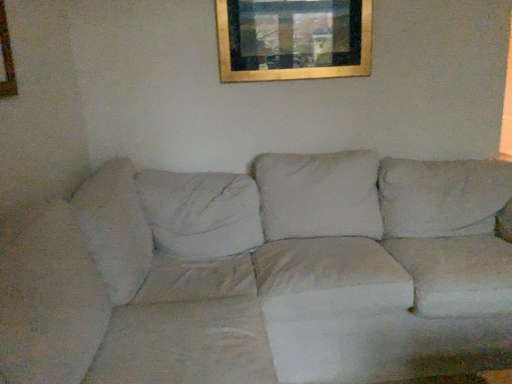
This screenshot has width=512, height=384. Describe the element at coordinates (261, 274) in the screenshot. I see `white fabric couch at center` at that location.

Find the location of `white fabric couch at center`. white fabric couch at center is located at coordinates (x=261, y=274).

This screenshot has width=512, height=384. What do you see at coordinates (293, 39) in the screenshot? I see `gold metallic picture frame at upper center` at bounding box center [293, 39].

Measure the distance between point (x=308, y=43) and camera.

Point (x=308, y=43) is 7.63 feet from camera.

Find the location of `gold metallic picture frame at upper center`. gold metallic picture frame at upper center is located at coordinates (293, 39).

What are the coordinates of `white fabric couch at center` in the screenshot? It's located at (261, 274).

Considering the relative positions of white fabric couch at center and gold metallic picture frame at upper center in the image provided, is white fabric couch at center to the left of gold metallic picture frame at upper center from the viewer's perspective?

Yes.

Does white fabric couch at center come behind gold metallic picture frame at upper center?

No, the depth of white fabric couch at center is less than that of gold metallic picture frame at upper center.

Which is in front, point (362, 345) or point (298, 6)?

Point (362, 345)

From the image's perspective, is white fabric couch at center above or below gold metallic picture frame at upper center?

Clearly, from the image's perspective, white fabric couch at center is below gold metallic picture frame at upper center.

From a real-world perspective, is white fabric couch at center positioned under gold metallic picture frame at upper center based on gravity?

Yes, from a real-world perspective, white fabric couch at center is under gold metallic picture frame at upper center.

Considering the relative sizes of white fabric couch at center and gold metallic picture frame at upper center in the image provided, is white fabric couch at center thinner than gold metallic picture frame at upper center?

In fact, white fabric couch at center might be wider than gold metallic picture frame at upper center.

Considering the sizes of objects white fabric couch at center and gold metallic picture frame at upper center in the image provided, who is taller, white fabric couch at center or gold metallic picture frame at upper center?

With more height is white fabric couch at center.

Based on their sizes in the image, would you say white fabric couch at center is bigger or smaller than gold metallic picture frame at upper center?

Clearly, white fabric couch at center is larger in size than gold metallic picture frame at upper center.

Could gold metallic picture frame at upper center be considered to be inside white fabric couch at center?

No, gold metallic picture frame at upper center is not inside white fabric couch at center.

Is white fabric couch at center next to gold metallic picture frame at upper center?

No, white fabric couch at center is not making contact with gold metallic picture frame at upper center.

Does white fabric couch at center turn towards gold metallic picture frame at upper center?

No, white fabric couch at center does not turn towards gold metallic picture frame at upper center.

How distant is white fabric couch at center from gold metallic picture frame at upper center?

white fabric couch at center is 36.03 inches away from gold metallic picture frame at upper center.

At what (x,y) coordinates should I click in order to perform the action: click on picture frame behind the white fabric couch at center. Please return your answer as a coordinate pair (x, y). Looking at the image, I should click on (293, 39).

Between gold metallic picture frame at upper center and white fabric couch at center, which one appears on the left side from the viewer's perspective?

white fabric couch at center is more to the left.

Based on the photo, is the position of gold metallic picture frame at upper center more distant than that of white fabric couch at center?

Yes.

Is point (352, 32) more distant than point (331, 198)?

Yes.

From the image's perspective, would you say gold metallic picture frame at upper center is shown under white fabric couch at center?

No.

From a real-world perspective, does gold metallic picture frame at upper center sit lower than white fabric couch at center?

No, from a real-world perspective, gold metallic picture frame at upper center is not under white fabric couch at center.

Considering the relative sizes of gold metallic picture frame at upper center and white fabric couch at center in the image provided, is gold metallic picture frame at upper center wider than white fabric couch at center?

In fact, gold metallic picture frame at upper center might be narrower than white fabric couch at center.

Does gold metallic picture frame at upper center have a lesser height compared to white fabric couch at center?

Yes, gold metallic picture frame at upper center is shorter than white fabric couch at center.

Is gold metallic picture frame at upper center smaller than white fabric couch at center?

Yes, gold metallic picture frame at upper center is smaller than white fabric couch at center.

Can we say gold metallic picture frame at upper center lies outside white fabric couch at center?

Yes, gold metallic picture frame at upper center is outside of white fabric couch at center.

Is the surface of gold metallic picture frame at upper center in direct contact with white fabric couch at center?

No, gold metallic picture frame at upper center is not in contact with white fabric couch at center.

Could you tell me if gold metallic picture frame at upper center is turned towards white fabric couch at center?

No, gold metallic picture frame at upper center is not facing towards white fabric couch at center.

How different are the orientations of gold metallic picture frame at upper center and white fabric couch at center in degrees?

They differ by 90.7 degrees in their facing directions.

Measure the distance from gold metallic picture frame at upper center to white fabric couch at center.

gold metallic picture frame at upper center is 36.03 inches away from white fabric couch at center.

At what (x,y) coordinates should I click in order to perform the action: click on picture frame on the right of white fabric couch at center. Please return your answer as a coordinate pair (x, y). The height and width of the screenshot is (384, 512). Looking at the image, I should click on (293, 39).

At what (x,y) coordinates should I click in order to perform the action: click on studio couch in front of the gold metallic picture frame at upper center. Please return your answer as a coordinate pair (x, y). Looking at the image, I should click on (261, 274).

This screenshot has height=384, width=512. Identify the location of studio couch on the left of gold metallic picture frame at upper center. (261, 274).